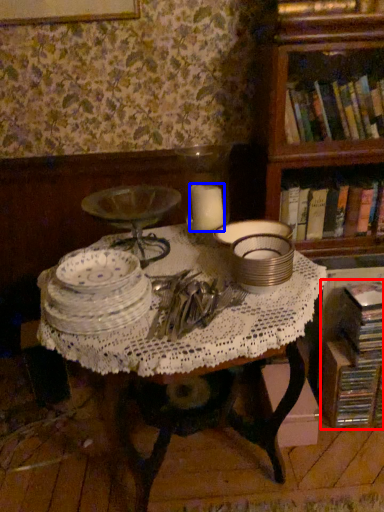
Question: Which point is further to the camera, book (highlighted by a red box) or candle (highlighted by a blue box)?

Choices:
 (A) book
 (B) candle

Answer: (A)